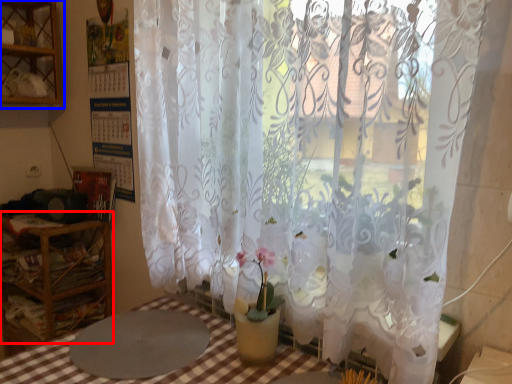
Question: Which object is further to the camera taking this photo, furniture (highlighted by a red box) or shelf (highlighted by a blue box)?

Choices:
 (A) furniture
 (B) shelf

Answer: (B)